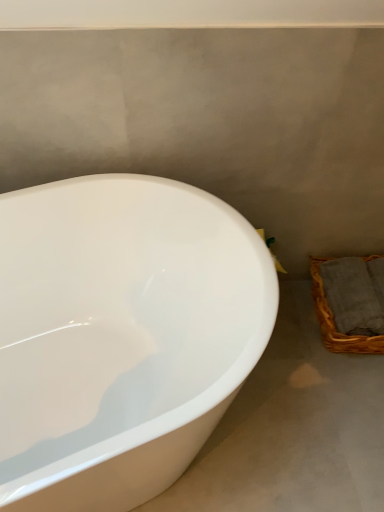
Question: In the image, is white glossy bathtub at left positioned in front of or behind woven brown basket at lower right?

Choices:
 (A) front
 (B) behind

Answer: (A)

Question: From a real-world perspective, is white glossy bathtub at left above or below woven brown basket at lower right?

Choices:
 (A) above
 (B) below

Answer: (A)

Question: Based on their positions, is white glossy bathtub at left located to the left or right of woven brown basket at lower right?

Choices:
 (A) right
 (B) left

Answer: (B)

Question: Do you think woven brown basket at lower right is within white glossy bathtub at left, or outside of it?

Choices:
 (A) outside
 (B) inside

Answer: (A)

Question: Is point (344, 287) closer or farther from the camera than point (94, 300)?

Choices:
 (A) farther
 (B) closer

Answer: (A)

Question: Considering the positions of woven brown basket at lower right and white glossy bathtub at left in the image, is woven brown basket at lower right wider or thinner than white glossy bathtub at left?

Choices:
 (A) wide
 (B) thin

Answer: (B)

Question: Considering the relative positions of woven brown basket at lower right and white glossy bathtub at left in the image provided, is woven brown basket at lower right to the left or to the right of white glossy bathtub at left?

Choices:
 (A) left
 (B) right

Answer: (B)